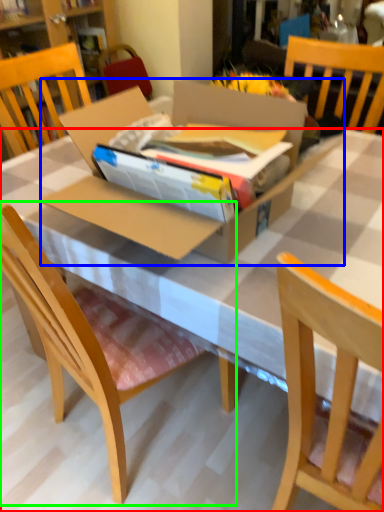
Question: Estimate the real-world distances between objects in this image. Which object is closer to desk (highlighted by a red box), cardboard box (highlighted by a blue box) or chair (highlighted by a green box)?

Choices:
 (A) cardboard box
 (B) chair

Answer: (A)